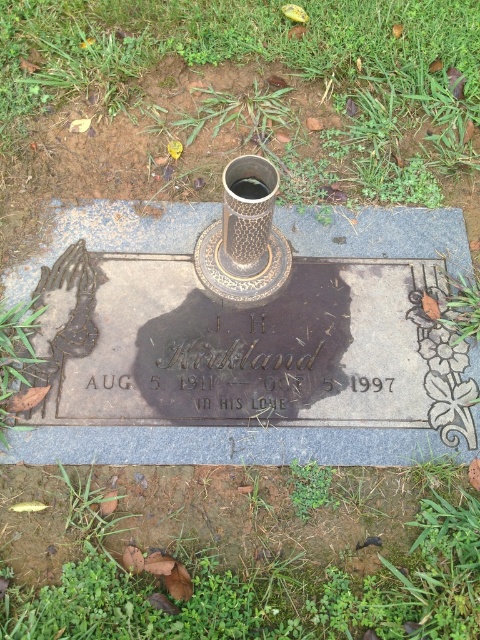
Question: Which point is farther from the camera taking this photo?

Choices:
 (A) (208, 108)
 (B) (265, 548)

Answer: (A)

Question: Which point is farther to the camera?

Choices:
 (A) (467, 627)
 (B) (87, 129)

Answer: (B)

Question: Which of the following is the closest to the observer?

Choices:
 (A) green grass at lower center
 (B) green grass at center

Answer: (A)

Question: Is green grass at center positioned before green grass at lower center?

Choices:
 (A) no
 (B) yes

Answer: (A)

Question: From the image, what is the correct spatial relationship of green grass at center in relation to green grass at lower center?

Choices:
 (A) above
 (B) below

Answer: (A)

Question: Is green grass at center further to camera compared to green grass at lower center?

Choices:
 (A) no
 (B) yes

Answer: (B)